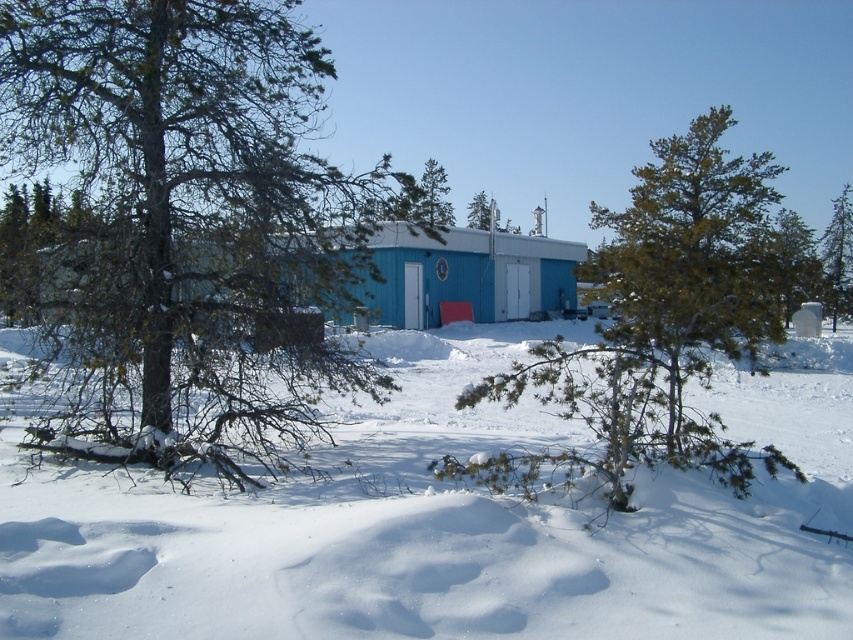
Who is higher up, blue matte building at center or green matte tree at upper right?

green matte tree at upper right

Who is more forward, [466,280] or [775,221]?

Point [466,280]

Is point (535, 252) positioned after point (770, 298)?

Yes, point (535, 252) is farther from viewer.

Find the location of a particular element. blue matte building at center is located at coordinates (463, 275).

Does white fluffy snow at center have a greater height compared to blue matte building at center?

No, white fluffy snow at center is not taller than blue matte building at center.

Can you confirm if white fluffy snow at center is shorter than blue matte building at center?

Correct, white fluffy snow at center is not as tall as blue matte building at center.

You are a GUI agent. You are given a task and a screenshot of the screen. Output one action in this format:
    pyautogui.click(x=<x>, y=<y>)
    Task: Click on the white fluffy snow at center
    The width and height of the screenshot is (853, 640).
    Given the screenshot: What is the action you would take?
    pyautogui.click(x=444, y=529)

Can you confirm if white fluffy snow at center is bigger than green matte tree at center?

Indeed, white fluffy snow at center has a larger size compared to green matte tree at center.

Does white fluffy snow at center appear on the right side of green matte tree at center?

Incorrect, white fluffy snow at center is not on the right side of green matte tree at center.

Does point (831, 394) come farther from viewer compared to point (473, 220)?

No.

At what (x,y) coordinates should I click in order to perform the action: click on white fluffy snow at center. Please return your answer as a coordinate pair (x, y). Looking at the image, I should click on (444, 529).